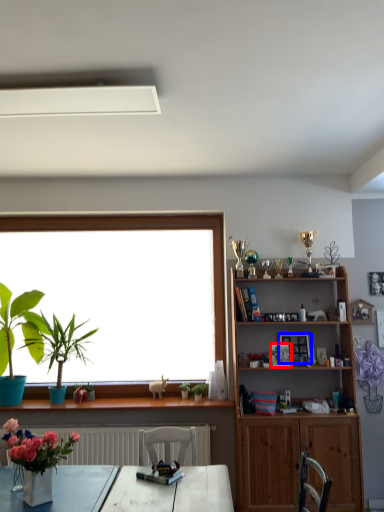
Question: Which object appears farthest to the camera in this image, picture frame (highlighted by a red box) or picture frame (highlighted by a blue box)?

Choices:
 (A) picture frame
 (B) picture frame

Answer: (B)